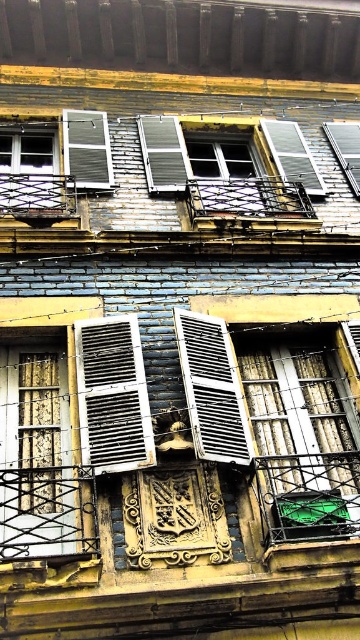
Which of these two, white matte shutter at center or metallic silver shutters at upper center, stands shorter?

white matte shutter at center is shorter.

Can you confirm if white matte shutter at center is smaller than metallic silver shutters at upper center?

Yes.

Locate an element on the screen. white matte shutter at center is located at coordinates (212, 388).

Based on the photo, which of these two, matte gray shutters at upper left or transparent glass window at upper right, stands shorter?

With less height is matte gray shutters at upper left.

Who is positioned more to the left, matte gray shutters at upper left or transparent glass window at upper right?

matte gray shutters at upper left is more to the left.

Describe the element at coordinates (87, 148) in the screenshot. This screenshot has width=360, height=640. I see `matte gray shutters at upper left` at that location.

At what (x,y) coordinates should I click in order to perform the action: click on matte gray shutters at upper left. Please return your answer as a coordinate pair (x, y). This screenshot has width=360, height=640. Looking at the image, I should click on (87, 148).

Between matte white window at upper left and wooden shutters at center, which one is positioned lower?

matte white window at upper left is below.

Which of these two, matte white window at upper left or wooden shutters at center, stands shorter?

With less height is matte white window at upper left.

Locate an element on the screen. matte white window at upper left is located at coordinates (29, 170).

This screenshot has height=640, width=360. In order to click on matte white window at upper left in this screenshot , I will do `click(29, 170)`.